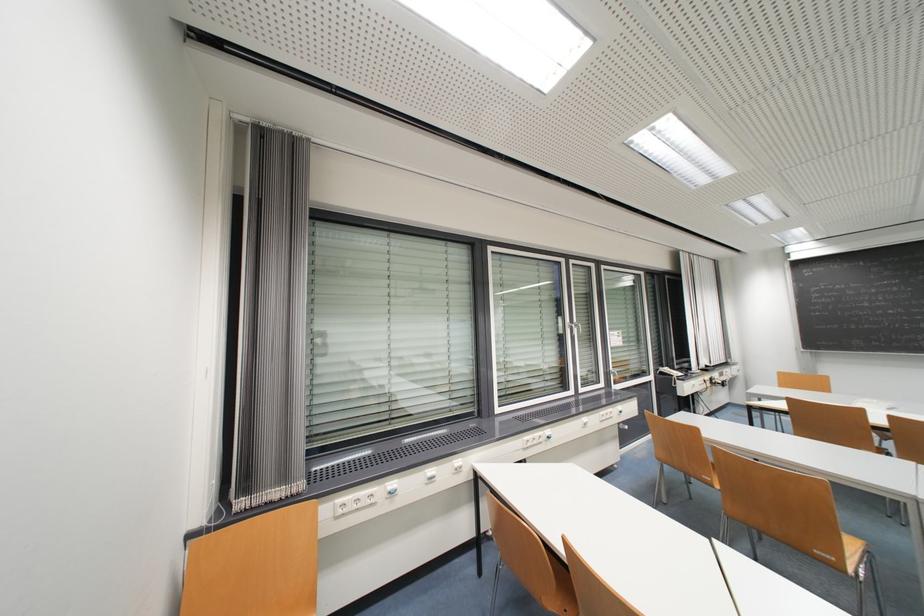
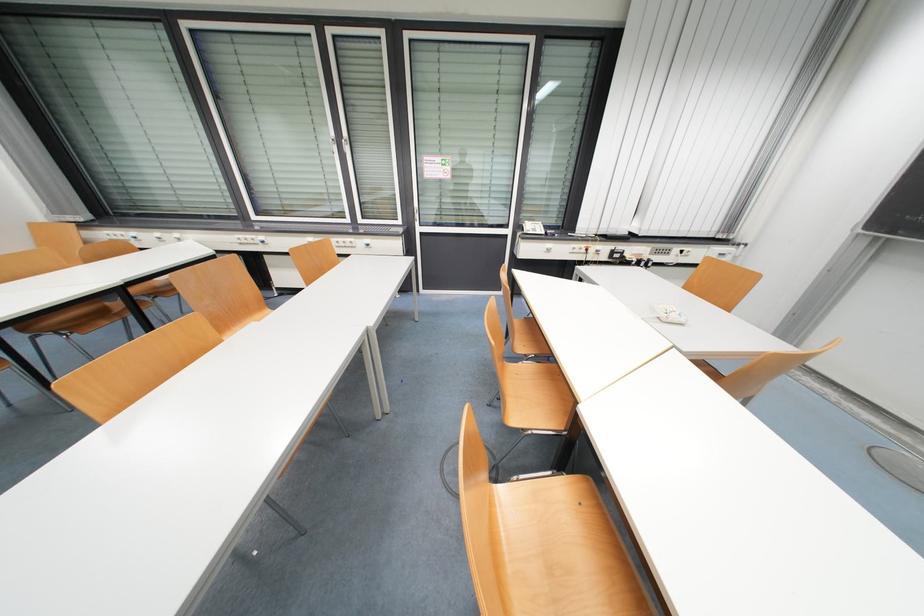
The point at (550, 440) is marked in the first image. Where is the corresponding point in the second image?

(262, 243)